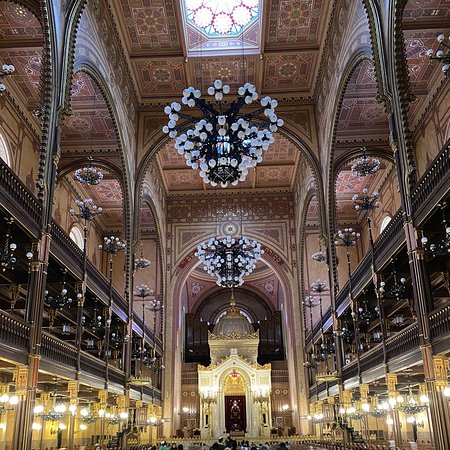
Where is `window`? The height and width of the screenshot is (450, 450). window is located at coordinates (248, 318), (385, 220), (2, 149), (74, 238).